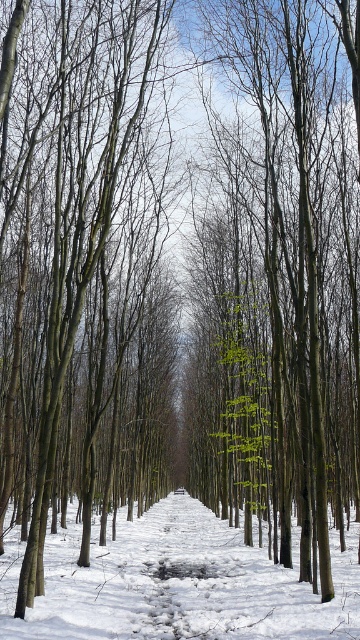
Question: Estimate the real-world distances between objects in this image. Which object is closer to the brown smooth tree at center?

Choices:
 (A) green leafy tree at center
 (B) white powdery snow at center

Answer: (B)

Question: Is brown smooth tree at center positioned at the back of white powdery snow at center?

Choices:
 (A) yes
 (B) no

Answer: (B)

Question: Which object is closer to the camera taking this photo?

Choices:
 (A) white powdery snow at center
 (B) brown smooth tree at center

Answer: (B)

Question: Which point is farther to the camera?

Choices:
 (A) (81, 80)
 (B) (290, 212)

Answer: (B)

Question: Is green leafy tree at center below white powdery snow at center?

Choices:
 (A) no
 (B) yes

Answer: (A)

Question: Does green leafy tree at center appear over white powdery snow at center?

Choices:
 (A) yes
 (B) no

Answer: (A)